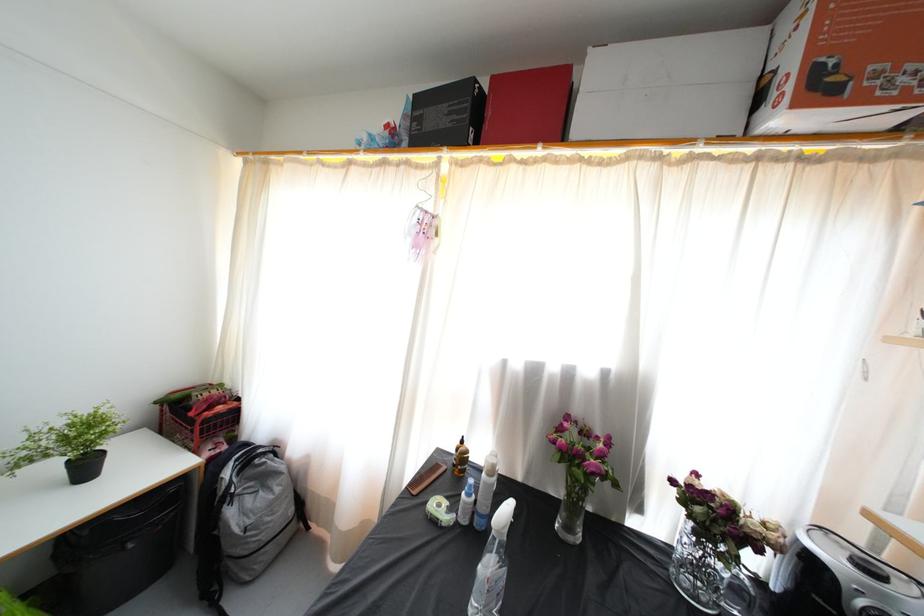
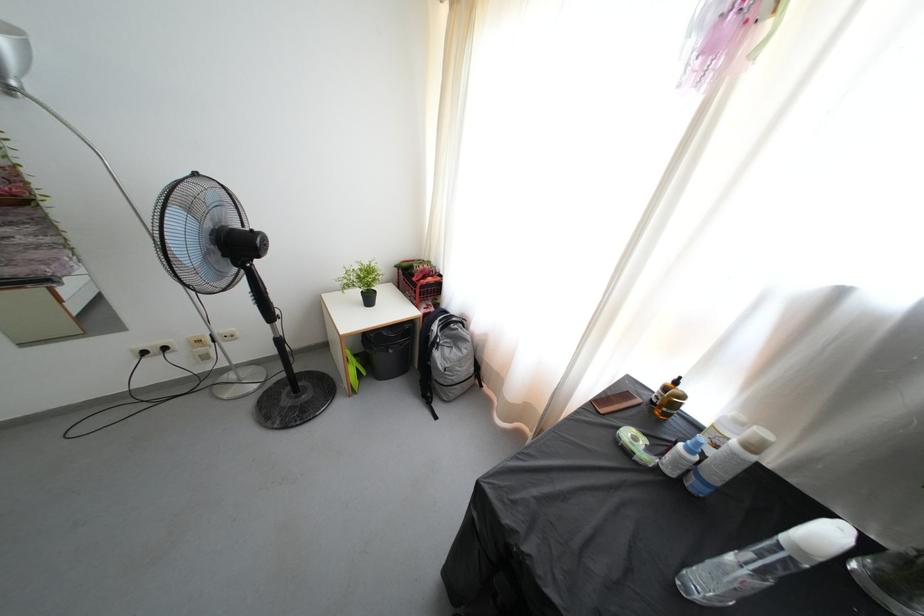
Locate, in the second image, the point that corresponds to pixel 93 451 in the first image.

(373, 291)